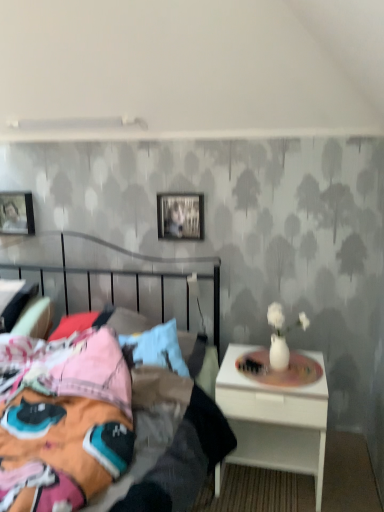
Question: Considering the relative positions of metallic silver bed at center and white glossy nightstand at right in the image provided, is metallic silver bed at center to the left or to the right of white glossy nightstand at right?

Choices:
 (A) right
 (B) left

Answer: (B)

Question: Considering the positions of metallic silver bed at center and white glossy nightstand at right in the image, is metallic silver bed at center wider or thinner than white glossy nightstand at right?

Choices:
 (A) thin
 (B) wide

Answer: (B)

Question: Which of these objects is positioned farthest from the metallic silver bed at center?

Choices:
 (A) white glossy nightstand at right
 (B) metallic silver picture frame at upper center, placed as the first picture frame when sorted from right to left
 (C) matte black picture frame at upper left, arranged as the 2th picture frame when viewed from the front

Answer: (C)

Question: Estimate the real-world distances between objects in this image. Which object is closer to the metallic silver picture frame at upper center, placed as the first picture frame when sorted from right to left?

Choices:
 (A) metallic silver bed at center
 (B) white glossy nightstand at right
 (C) matte black picture frame at upper left, arranged as the 2th picture frame when viewed from the front

Answer: (C)